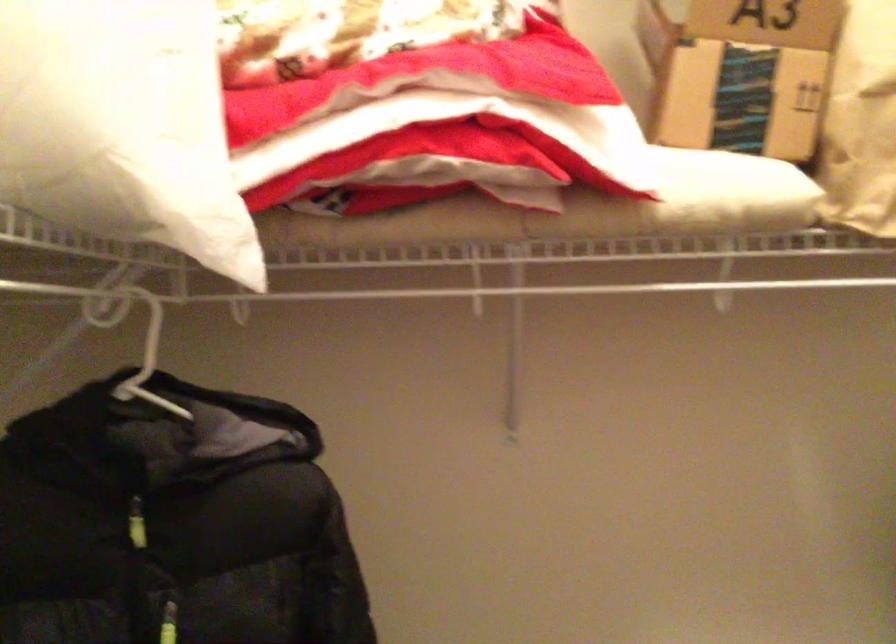
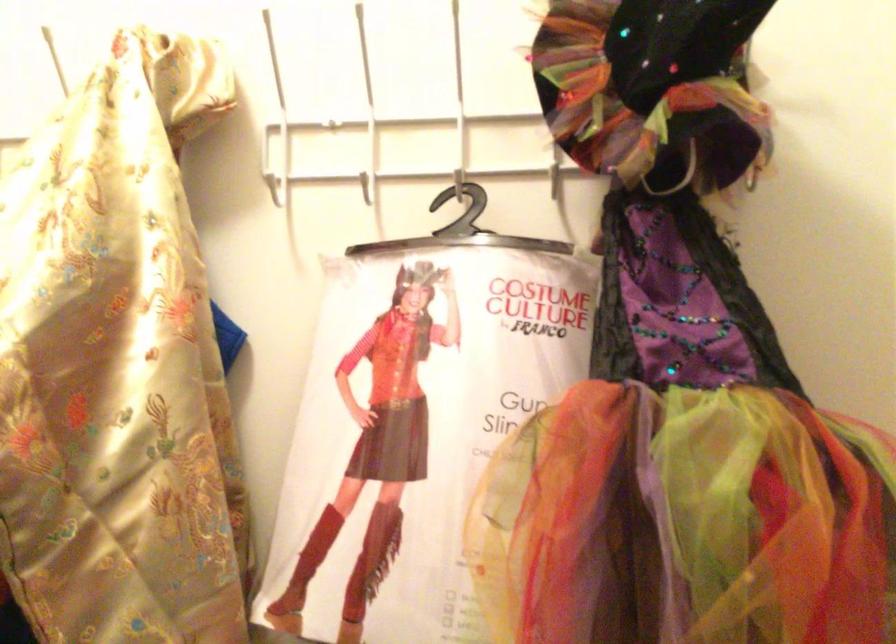
Question: The camera is either moving clockwise (left) or counter-clockwise (right) around the object. The first image is from the beginning of the video and the second image is from the end. Is the camera moving left or right when shooting the video?

Choices:
 (A) Left
 (B) Right

Answer: (A)